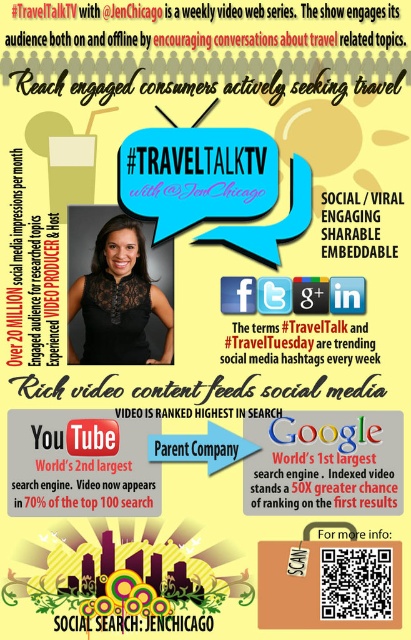
How distant is black lace dress at center from gold metallic text at center?

black lace dress at center is 18.86 inches away from gold metallic text at center.

Is black lace dress at center further to camera compared to gold metallic text at center?

Yes.

Does point (92, 344) come behind point (290, 458)?

Yes, point (92, 344) is behind point (290, 458).

This screenshot has height=640, width=411. Identify the location of black lace dress at center. (119, 300).

Does whitetextured papersign at upper right appear on the right side of black text at center?

Correct, you'll find whitetextured papersign at upper right to the right of black text at center.

Is whitetextured papersign at upper right further to the viewer compared to black text at center?

No.

Measure the distance between whitetextured papersign at upper right and camera.

whitetextured papersign at upper right and camera are 1.41 meters apart from each other.

This screenshot has height=640, width=411. I want to click on whitetextured papersign at upper right, so click(357, 224).

Is gold metallic text at center smaller than black text at center?

No.

Is gold metallic text at center above black text at center?

No, gold metallic text at center is not above black text at center.

This screenshot has height=640, width=411. I want to click on gold metallic text at center, so click(x=321, y=483).

Identify the location of gold metallic text at center. The width and height of the screenshot is (411, 640). (321, 483).